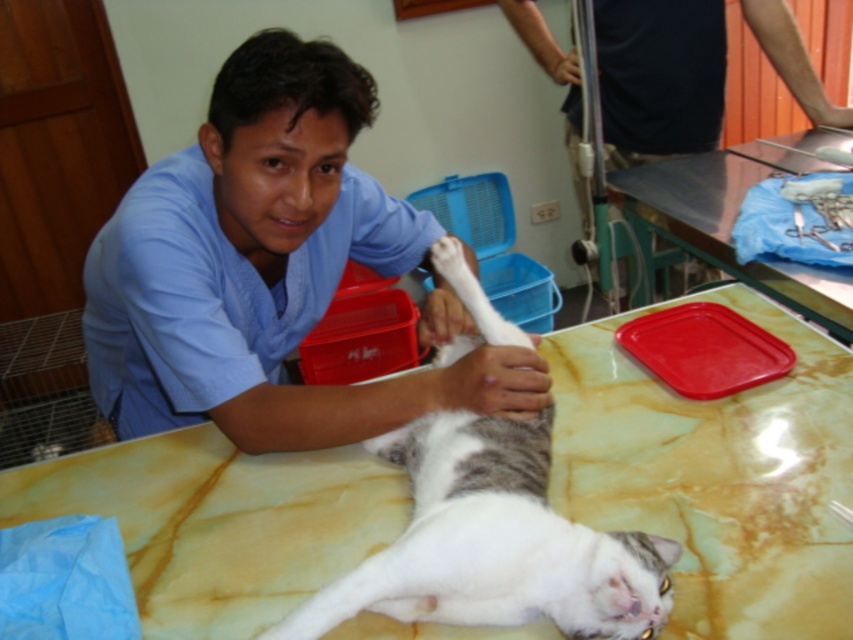
Between white fur cat at center and dark blue scrubs at upper left, which one appears on the left side from the viewer's perspective?

white fur cat at center is more to the left.

I want to click on white fur cat at center, so click(492, 541).

The height and width of the screenshot is (640, 853). In order to click on white fur cat at center in this screenshot , I will do `click(492, 541)`.

I want to click on white fur cat at center, so click(492, 541).

Between white fur cat at center and red plastic tray at upper right, which one is positioned lower?

Positioned lower is white fur cat at center.

Does white fur cat at center come in front of red plastic tray at upper right?

That is True.

Which is in front, point (508, 490) or point (805, 131)?

Point (508, 490)

The width and height of the screenshot is (853, 640). Find the location of `white fur cat at center`. white fur cat at center is located at coordinates (492, 541).

In the scene shown: Does dark blue scrubs at upper left have a greater height compared to red plastic tray at upper right?

Correct, dark blue scrubs at upper left is much taller as red plastic tray at upper right.

Is dark blue scrubs at upper left shorter than red plastic tray at upper right?

No.

Identify the location of dark blue scrubs at upper left. Image resolution: width=853 pixels, height=640 pixels. (660, 76).